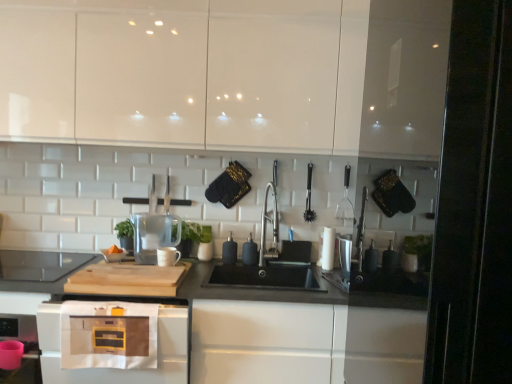
Question: From a real-world perspective, is satin nickel faucet at center positioned under black matte soap dispenser at center, which ranks as the fourth appliance in right-to-left order, based on gravity?

Choices:
 (A) yes
 (B) no

Answer: (B)

Question: Considering the relative positions of satin nickel faucet at center and black matte soap dispenser at center, which ranks as the fourth appliance in right-to-left order, in the image provided, is satin nickel faucet at center to the right of black matte soap dispenser at center, which ranks as the fourth appliance in right-to-left order, from the viewer's perspective?

Choices:
 (A) yes
 (B) no

Answer: (A)

Question: Does satin nickel faucet at center appear on the left side of black matte soap dispenser at center, which ranks as the fourth appliance in right-to-left order?

Choices:
 (A) yes
 (B) no

Answer: (B)

Question: Is satin nickel faucet at center directly adjacent to black matte soap dispenser at center, which ranks as the fourth appliance in right-to-left order?

Choices:
 (A) yes
 (B) no

Answer: (B)

Question: Is satin nickel faucet at center oriented towards black matte soap dispenser at center, which appears as the third appliance when viewed from the left?

Choices:
 (A) yes
 (B) no

Answer: (B)

Question: Can you confirm if satin nickel faucet at center is wider than black matte soap dispenser at center, which appears as the third appliance when viewed from the left?

Choices:
 (A) yes
 (B) no

Answer: (A)

Question: Can you confirm if black rubber brush at center, acting as the 5th appliance starting from the left, is positioned to the right of matte white microwave at lower left?

Choices:
 (A) no
 (B) yes

Answer: (B)

Question: Does black rubber brush at center, acting as the 5th appliance starting from the left, have a larger size compared to matte white microwave at lower left?

Choices:
 (A) no
 (B) yes

Answer: (A)

Question: Is black rubber brush at center, placed as the 2th appliance when sorted from right to left, not near matte white microwave at lower left?

Choices:
 (A) no
 (B) yes

Answer: (B)

Question: Is black rubber brush at center, placed as the 2th appliance when sorted from right to left, further to the viewer compared to matte white microwave at lower left?

Choices:
 (A) yes
 (B) no

Answer: (A)

Question: From a real-world perspective, is black rubber brush at center, acting as the 5th appliance starting from the left, physically above matte white microwave at lower left?

Choices:
 (A) no
 (B) yes

Answer: (B)

Question: Is black rubber brush at center, acting as the 5th appliance starting from the left, wider than matte white microwave at lower left?

Choices:
 (A) no
 (B) yes

Answer: (B)

Question: Does natural wood cutting board at center have a larger size compared to transparent glass pitcher at center, which is the 1th appliance from left to right?

Choices:
 (A) yes
 (B) no

Answer: (A)